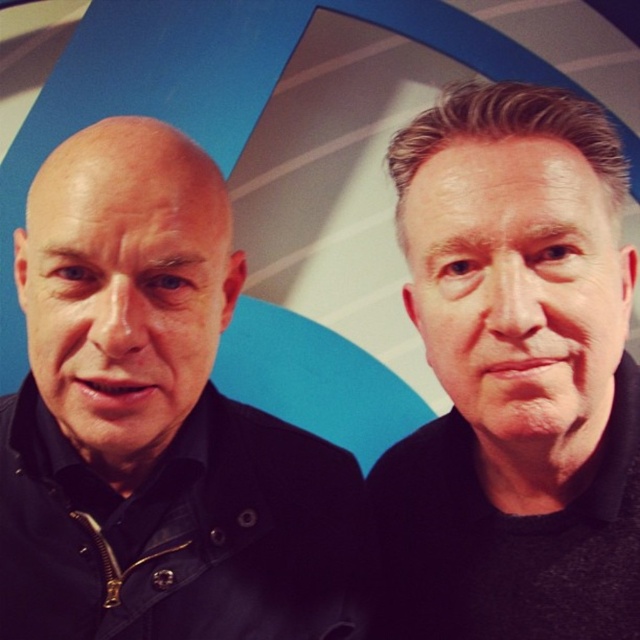
Question: Can you confirm if black matte jacket at right is positioned to the left of bald head at left?

Choices:
 (A) no
 (B) yes

Answer: (A)

Question: Does black matte jacket at right appear over smooth skin face at right?

Choices:
 (A) no
 (B) yes

Answer: (A)

Question: Which point is closer to the camera taking this photo?

Choices:
 (A) (112, 588)
 (B) (124, 410)
 (C) (573, 262)

Answer: (C)

Question: Which point appears closest to the camera in this image?

Choices:
 (A) (522, 280)
 (B) (600, 172)
 (C) (157, 316)
 (D) (266, 580)

Answer: (A)

Question: Can you confirm if black matte jacket at left is smaller than black matte jacket at right?

Choices:
 (A) no
 (B) yes

Answer: (B)

Question: Which point appears closest to the camera in this image?

Choices:
 (A) (573, 547)
 (B) (51, 545)
 (C) (129, 483)

Answer: (A)